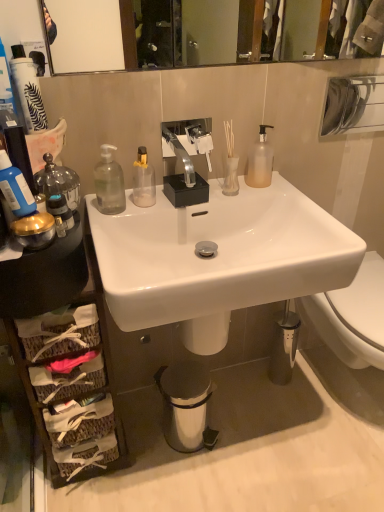
Question: Is metallic trash can at lower center turned away from white frosted glass vase at upper center?

Choices:
 (A) no
 (B) yes

Answer: (A)

Question: Does metallic trash can at lower center lie in front of white frosted glass vase at upper center?

Choices:
 (A) yes
 (B) no

Answer: (B)

Question: From a real-world perspective, is metallic trash can at lower center physically above white frosted glass vase at upper center?

Choices:
 (A) yes
 (B) no

Answer: (B)

Question: Is metallic trash can at lower center outside white frosted glass vase at upper center?

Choices:
 (A) yes
 (B) no

Answer: (A)

Question: Does metallic trash can at lower center have a lesser width compared to white frosted glass vase at upper center?

Choices:
 (A) yes
 (B) no

Answer: (B)

Question: Is polished chrome faucet at center, which is the first sink in top-to-bottom order, spatially inside blue matte bottle at left, the third bottle when ordered from right to left, or outside of it?

Choices:
 (A) inside
 (B) outside

Answer: (B)

Question: Based on their positions, is polished chrome faucet at center, which is the first sink in top-to-bottom order, located to the left or right of blue matte bottle at left, the third bottle when ordered from right to left?

Choices:
 (A) left
 (B) right

Answer: (B)

Question: From their relative heights in the image, would you say polished chrome faucet at center, the 2th sink positioned from the bottom, is taller or shorter than blue matte bottle at left, which ranks as the 3th bottle in back-to-front order?

Choices:
 (A) tall
 (B) short

Answer: (B)

Question: From a real-world perspective, is polished chrome faucet at center, which is the first sink in top-to-bottom order, physically located above or below blue matte bottle at left, which is the first bottle from front to back?

Choices:
 (A) above
 (B) below

Answer: (B)

Question: Is white frosted glass vase at upper center to the left or to the right of metallic trash can at lower center in the image?

Choices:
 (A) right
 (B) left

Answer: (A)

Question: From a real-world perspective, is white frosted glass vase at upper center physically located above or below metallic trash can at lower center?

Choices:
 (A) above
 (B) below

Answer: (A)

Question: Which is correct: white frosted glass vase at upper center is inside metallic trash can at lower center, or outside of it?

Choices:
 (A) outside
 (B) inside

Answer: (A)

Question: In terms of size, does white frosted glass vase at upper center appear bigger or smaller than metallic trash can at lower center?

Choices:
 (A) big
 (B) small

Answer: (B)

Question: From a real-world perspective, is blue matte bottle at left, which is the first bottle from front to back, positioned above or below translucent glass vase at upper center?

Choices:
 (A) below
 (B) above

Answer: (B)

Question: Is blue matte bottle at left, which ranks as the 3th bottle in back-to-front order, taller or shorter than translucent glass vase at upper center?

Choices:
 (A) tall
 (B) short

Answer: (A)